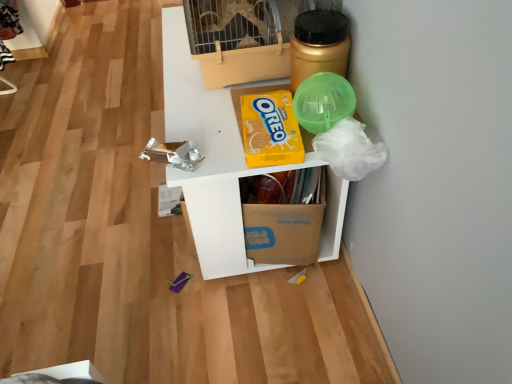
The image size is (512, 384). Find the location of `vacant space in front of white cardboard box at upper center`. vacant space in front of white cardboard box at upper center is located at coordinates (221, 327).